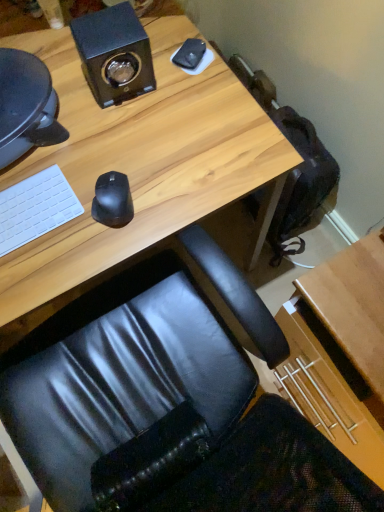
Image resolution: width=384 pixels, height=512 pixels. In order to click on vacant area that lies between black matte mouse at center and white matte keyboard at left in this screenshot , I will do `click(66, 223)`.